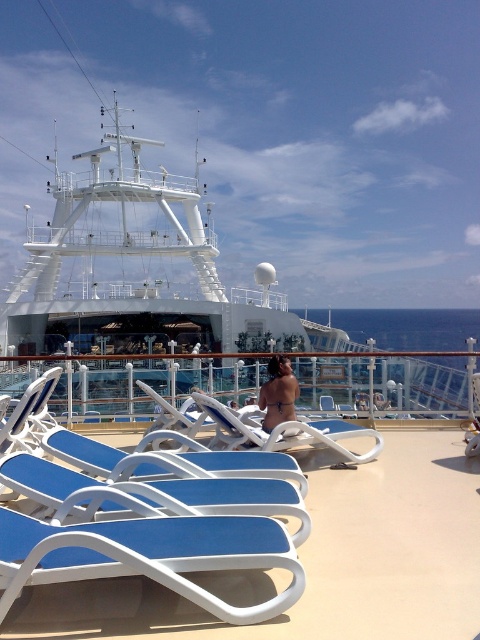
You are a passenger on the cruise ship and want to take a photo of the white glossy boat at upper center using your phone. You are standing near the blue plastic lounge chair at lower left. Is the boat in your camera view if you look straight ahead?

The white glossy boat at upper center is larger in size compared to the blue plastic lounge chair at lower left, which suggests that the boat is closer to you. Since you are standing near the blue plastic lounge chair at lower left and looking straight ahead, the white glossy boat at upper center would likely be within your camera view as it is positioned in the upper part of the scene.

You are standing on the deck of the cruise ship and see the white glossy boat at upper center. If you want to throw a small ball to reach it, considering the ball can travel 6 meters, will it be possible?

The white glossy boat at upper center is 7.13 meters from camera, which is farther than the ball can travel 6 meters. So it is not possible.

You are a passenger on the cruise ship and want to take a photo of the white glossy boat at upper center and the blue plastic lounge chair at lower left. Which object should you zoom in on to capture both in the frame without moving your camera?

You should zoom in on the blue plastic lounge chair at lower left because the white glossy boat at upper center is wider, so zooming in on the smaller object allows both to fit in the frame.